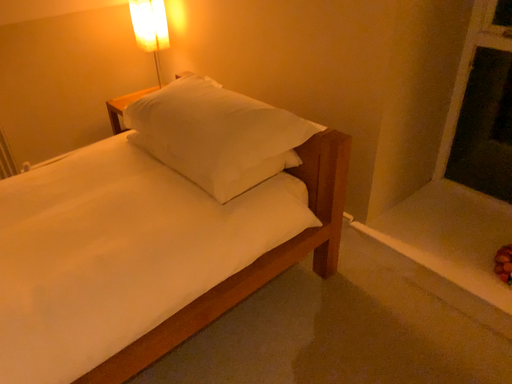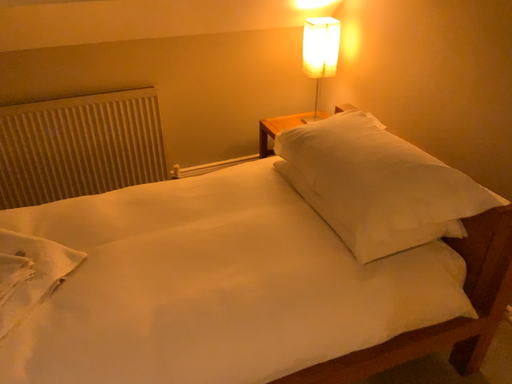
Question: Which way did the camera rotate in the video?

Choices:
 (A) rotated left
 (B) rotated right

Answer: (A)